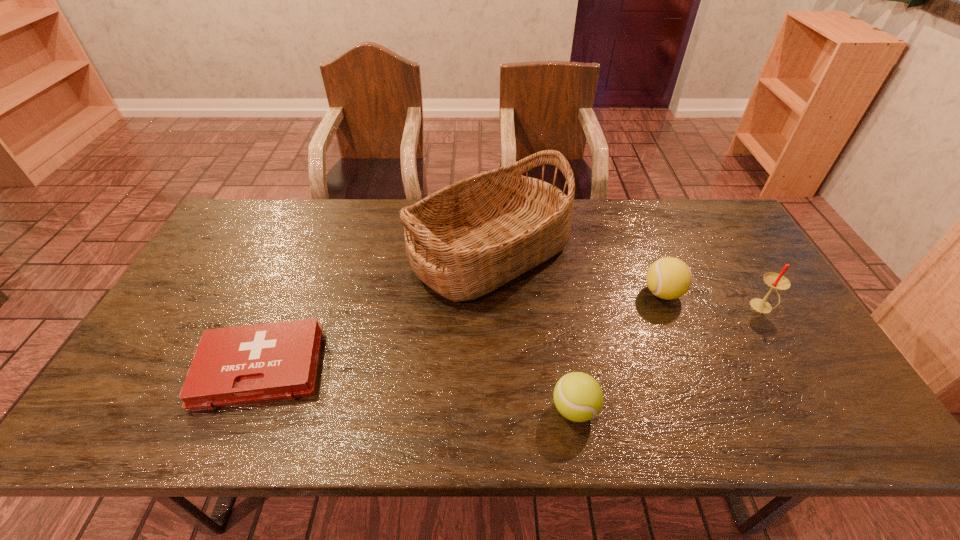
Identify the location of free space located 0.100m on the right of the farther tennis ball. (718, 293).

The height and width of the screenshot is (540, 960). Identify the location of free space located on the back of the nearer tennis ball. (567, 367).

This screenshot has width=960, height=540. I want to click on vacant space located on the right of the shortest object, so click(418, 368).

Where is `object that is positioned at the far edge`? The width and height of the screenshot is (960, 540). object that is positioned at the far edge is located at coordinates (464, 241).

Find the location of a particular element. Image resolution: width=960 pixels, height=540 pixels. tennis ball that is at the near edge is located at coordinates (578, 397).

Where is `the first-aid kit that is positioned at the near edge`? Image resolution: width=960 pixels, height=540 pixels. the first-aid kit that is positioned at the near edge is located at coordinates (248, 364).

Locate an element on the screen. Image resolution: width=960 pixels, height=540 pixels. object positioned at the left edge is located at coordinates [x=248, y=364].

This screenshot has width=960, height=540. I want to click on object at the right edge, so click(776, 281).

This screenshot has height=540, width=960. I want to click on object positioned at the near left corner, so click(x=248, y=364).

I want to click on free space at the far edge of the desktop, so click(601, 218).